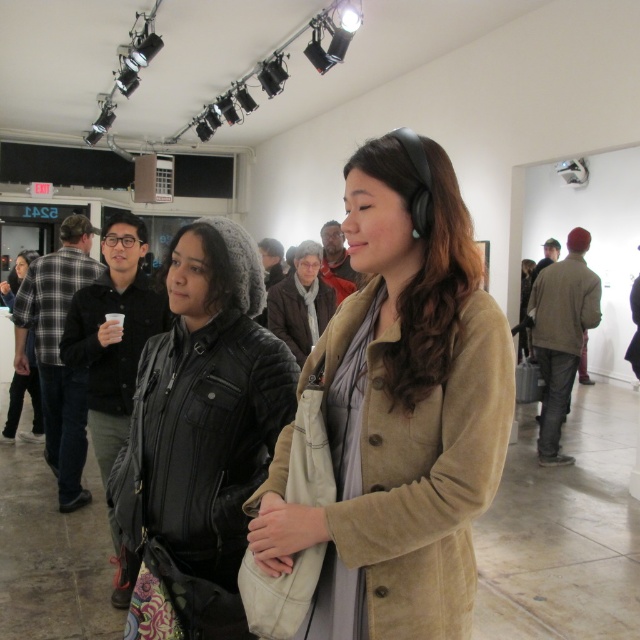
Consider the image. Can you confirm if suede beige coat at center is taller than black quilted jacket at center?

No, suede beige coat at center is not taller than black quilted jacket at center.

Who is more distant from viewer, (330, 541) or (163, 406)?

Point (163, 406)

Where is `suede beige coat at center`? The width and height of the screenshot is (640, 640). suede beige coat at center is located at coordinates (400, 410).

Locate an element on the screen. The width and height of the screenshot is (640, 640). suede beige coat at center is located at coordinates (400, 410).